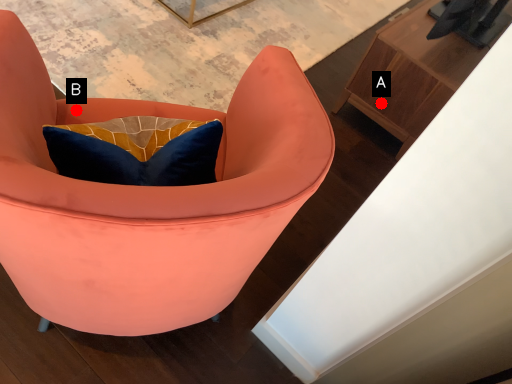
Question: Two points are circled on the image, labeled by A and B beside each circle. Which point is closer to the camera taking this photo?

Choices:
 (A) A is closer
 (B) B is closer

Answer: (B)